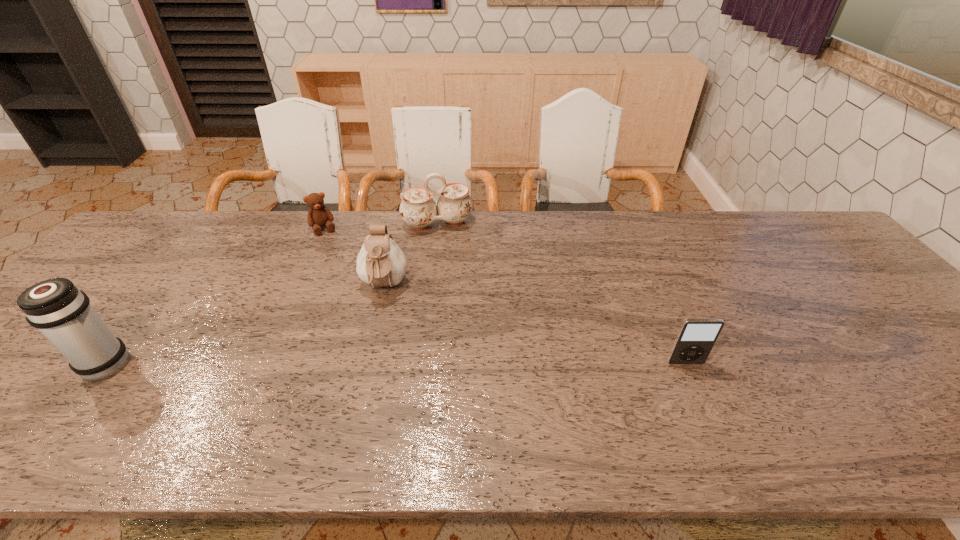
Choose which object is the nearest neighbor to the rightmost object. Please provide its 2D coordinates. Your answer should be formatted as a tuple, i.e. [(x, y)], where the tuple contains the x and y coordinates of a point satisfying the conditions above.

[(380, 262)]